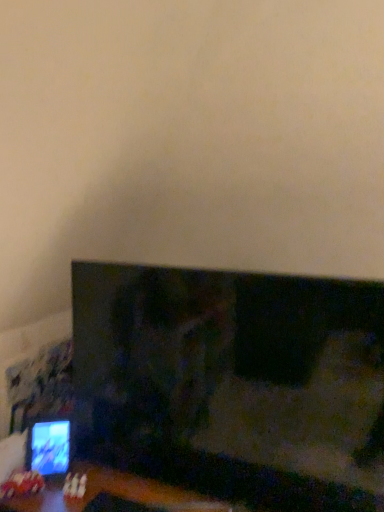
Question: From a real-world perspective, is matte black monitor at lower left positioned over matte black tv at lower left based on gravity?

Choices:
 (A) no
 (B) yes

Answer: (A)

Question: Is matte black monitor at lower left to the left of matte black tv at lower left from the viewer's perspective?

Choices:
 (A) no
 (B) yes

Answer: (B)

Question: Is matte black monitor at lower left wider than matte black tv at lower left?

Choices:
 (A) yes
 (B) no

Answer: (B)

Question: Is matte black monitor at lower left outside of matte black tv at lower left?

Choices:
 (A) no
 (B) yes

Answer: (B)

Question: Could you tell me if matte black monitor at lower left is facing matte black tv at lower left?

Choices:
 (A) yes
 (B) no

Answer: (B)

Question: Is matte black monitor at lower left placed right next to matte black tv at lower left?

Choices:
 (A) no
 (B) yes

Answer: (A)

Question: From a real-world perspective, is matte black tv at lower left under matte black monitor at lower left?

Choices:
 (A) yes
 (B) no

Answer: (B)

Question: Is matte black tv at lower left located outside matte black monitor at lower left?

Choices:
 (A) no
 (B) yes

Answer: (B)

Question: Is matte black tv at lower left facing away from matte black monitor at lower left?

Choices:
 (A) no
 (B) yes

Answer: (A)

Question: Would you say matte black tv at lower left contains matte black monitor at lower left?

Choices:
 (A) no
 (B) yes

Answer: (A)

Question: Is matte black tv at lower left not near matte black monitor at lower left?

Choices:
 (A) no
 (B) yes

Answer: (A)

Question: Is matte black tv at lower left next to matte black monitor at lower left?

Choices:
 (A) yes
 (B) no

Answer: (B)

Question: In terms of height, does matte black tv at lower left look taller or shorter compared to matte black monitor at lower left?

Choices:
 (A) tall
 (B) short

Answer: (A)